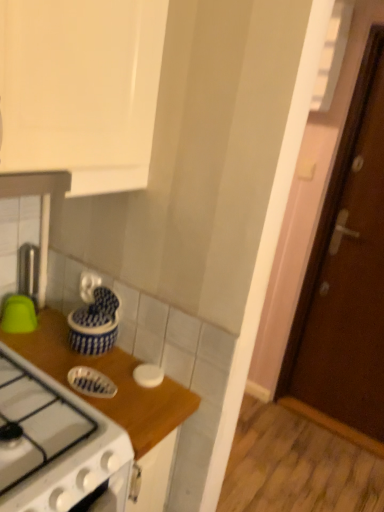
Where is `spots to the right of blue glossy dish at center, arranged as the 2th kitchen appliance when viewed from the right`? This screenshot has width=384, height=512. spots to the right of blue glossy dish at center, arranged as the 2th kitchen appliance when viewed from the right is located at coordinates (148, 399).